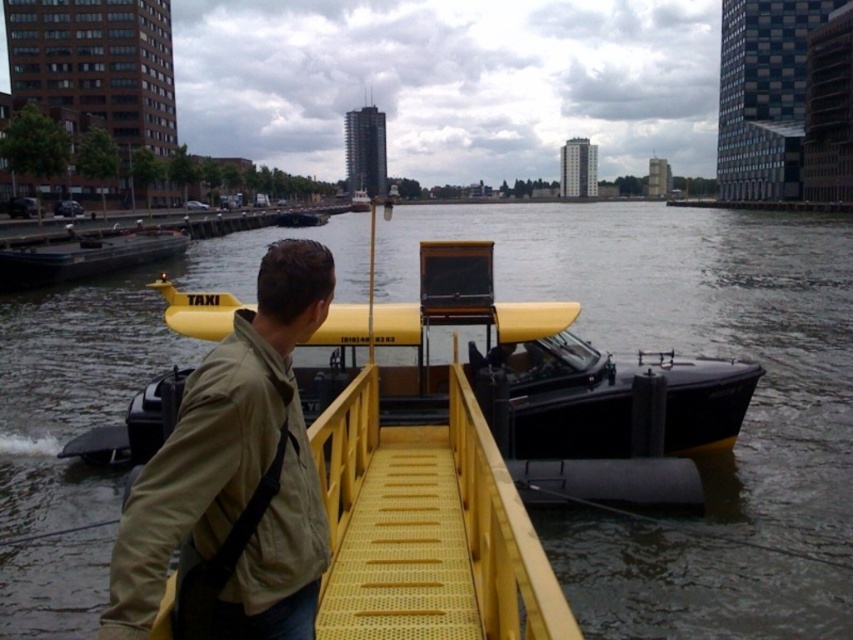
You are standing at the waterfront and want to know which of the two points, point (x=258, y=380) or point (x=485, y=252), is closer to you. Based on the scene, can you determine which one is nearer?

Point (x=258, y=380) is closer to the viewer than point (x=485, y=252).